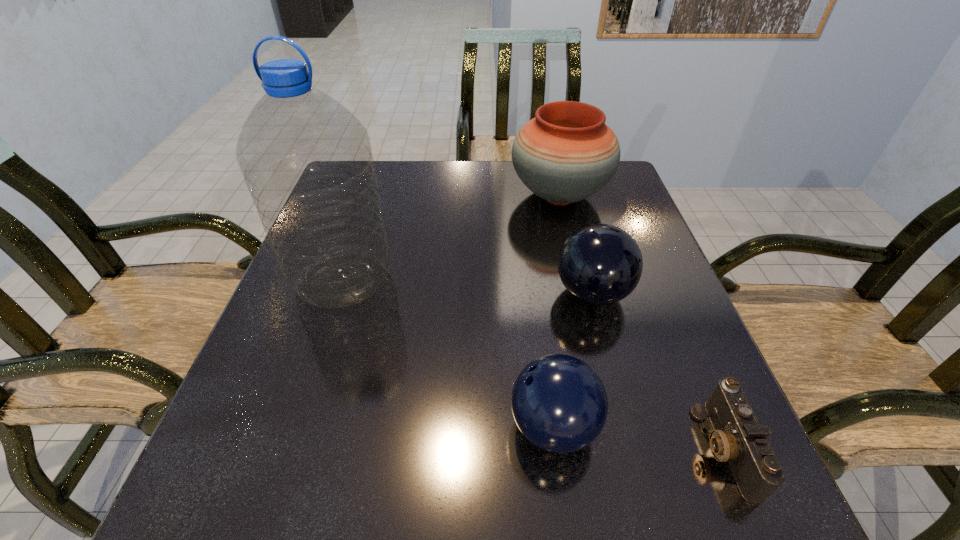
This screenshot has height=540, width=960. What are the coordinates of `free spot between the shortest object and the pottery` in the screenshot? It's located at (641, 322).

Find the location of a particular element. This screenshot has height=540, width=960. vacant point located between the nearer bowling ball and the camera is located at coordinates (638, 437).

Find the location of `free space between the water jug and the nearer bowling ball`. free space between the water jug and the nearer bowling ball is located at coordinates (448, 353).

Locate an element on the screen. The image size is (960, 540). empty space between the tallest object and the pottery is located at coordinates (451, 237).

This screenshot has width=960, height=540. Find the location of `unoccupied position between the shortest object and the nearer bowling ball`. unoccupied position between the shortest object and the nearer bowling ball is located at coordinates (638, 437).

At what (x,y) coordinates should I click in order to perform the action: click on vacant area that lies between the fourth shortest object and the camera. Please return your answer as a coordinate pair (x, y). The height and width of the screenshot is (540, 960). Looking at the image, I should click on (641, 322).

Locate an element on the screen. free space between the farthest object and the nearer bowling ball is located at coordinates (557, 311).

The width and height of the screenshot is (960, 540). In order to click on vacant space that is in between the farthest object and the nearer bowling ball in this screenshot , I will do `click(557, 311)`.

Find the location of a particular element. Image resolution: width=960 pixels, height=540 pixels. vacant space that's between the farthest object and the camera is located at coordinates 641,322.

Select which object is the fourth closest to the shortest object. Please provide its 2D coordinates. Your answer should be formatted as a tuple, i.e. [(x, y)], where the tuple contains the x and y coordinates of a point satisfying the conditions above.

[(307, 161)]